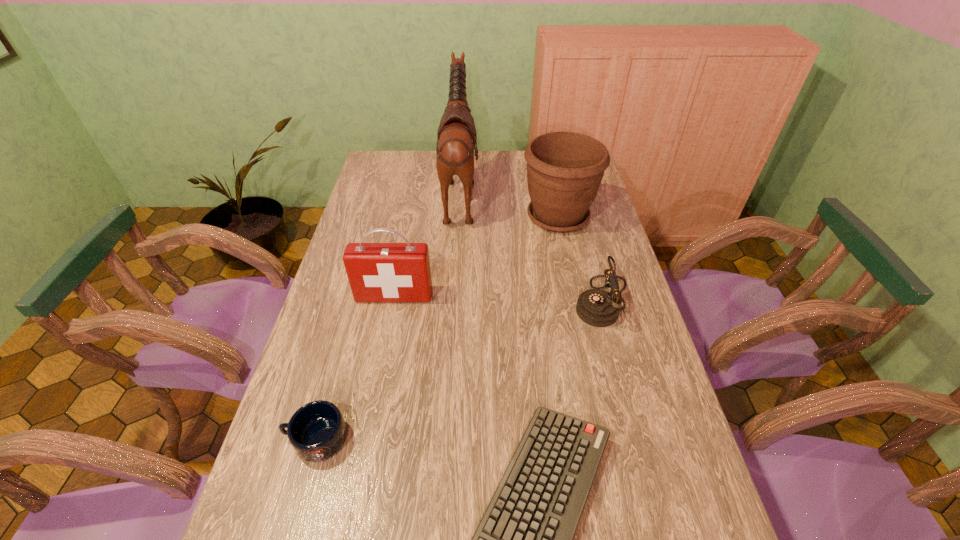
Locate an element on the screen. The width and height of the screenshot is (960, 540). saddle is located at coordinates (456, 137).

Find the location of a particular element. flowerpot is located at coordinates (564, 169).

The width and height of the screenshot is (960, 540). I want to click on the first-aid kit, so click(377, 272).

This screenshot has height=540, width=960. I want to click on telephone, so click(x=596, y=307).

You are a GUI agent. You are given a task and a screenshot of the screen. Output one action in this format:
    pyautogui.click(x=<x>, y=<y>)
    Task: Click on the fifth tallest object
    This screenshot has width=960, height=540.
    Given the screenshot: What is the action you would take?
    pyautogui.click(x=317, y=430)

Where is `free space located on the back of the tallest object`? The width and height of the screenshot is (960, 540). free space located on the back of the tallest object is located at coordinates (496, 192).

Identify the location of free space located on the front of the flowerpot. This screenshot has width=960, height=540. point(576,300).

At what (x,y) coordinates should I click in order to perform the action: click on free space located on the front face of the first-aid kit. Please return your answer as a coordinate pair (x, y). The image size is (960, 540). Looking at the image, I should click on (388, 328).

Identify the location of vacant position located 0.260m on the front of the third shortest object. (635, 416).

Where is `object present at the far edge`? The width and height of the screenshot is (960, 540). object present at the far edge is located at coordinates (456, 137).